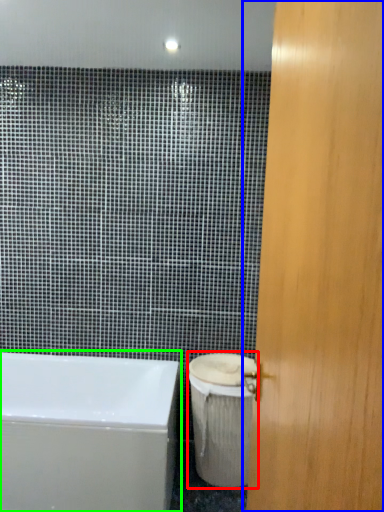
Question: Estimate the real-world distances between objects in this image. Which object is closer to toilet bowl (highlighted by a red box), door (highlighted by a blue box) or bathtub (highlighted by a green box)?

Choices:
 (A) door
 (B) bathtub

Answer: (B)